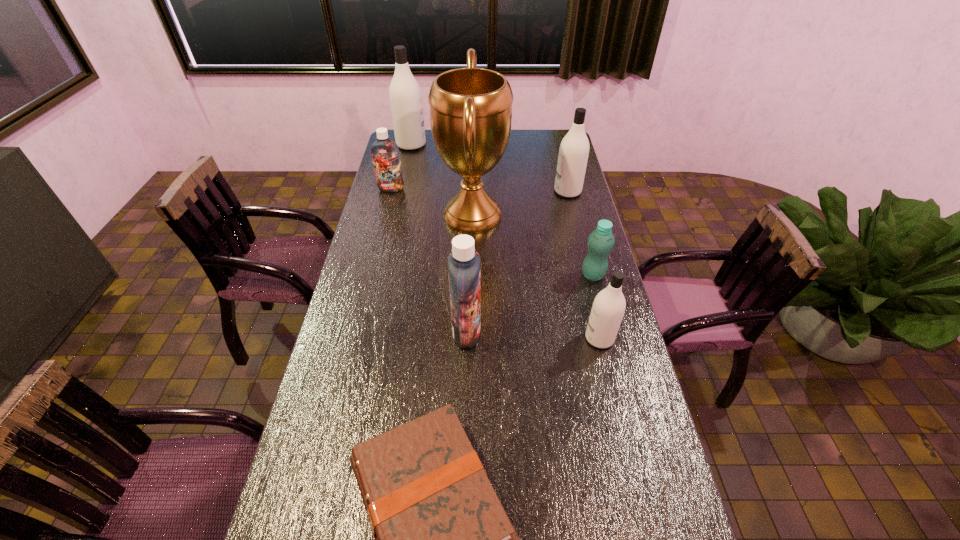
Select which white shampoo is the closest to the smallest white shampoo. Please provide its 2D coordinates. Your answer should be formatted as a tuple, i.e. [(x, y)], where the tuple contains the x and y coordinates of a point satisfying the conditions above.

[(573, 154)]